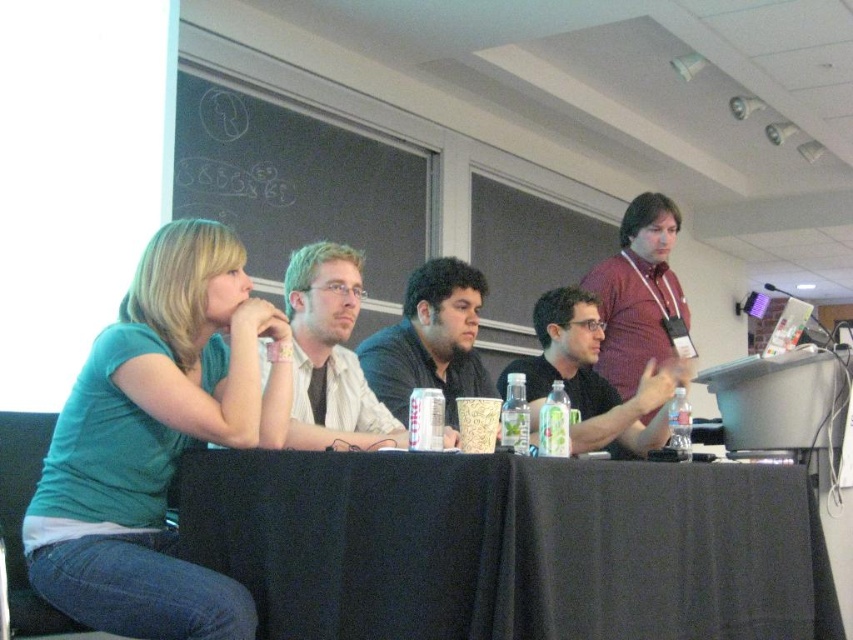
Question: Can you confirm if teal matte shirt at left is thinner than matte white shirt at center?

Choices:
 (A) no
 (B) yes

Answer: (A)

Question: Is black fabric table at center thinner than dark brown shirt at center?

Choices:
 (A) yes
 (B) no

Answer: (B)

Question: Can you confirm if teal matte shirt at left is wider than dark brown shirt at center?

Choices:
 (A) no
 (B) yes

Answer: (B)

Question: Considering the real-world distances, which object is closest to the dark brown shirt at center?

Choices:
 (A) teal matte shirt at left
 (B) black fabric table at center

Answer: (A)

Question: Which point is farther to the camera?

Choices:
 (A) (579, 433)
 (B) (252, 397)
 (C) (476, 356)
 (D) (341, 579)

Answer: (C)

Question: Which object appears closest to the camera in this image?

Choices:
 (A) teal matte shirt at left
 (B) matte white shirt at center

Answer: (A)